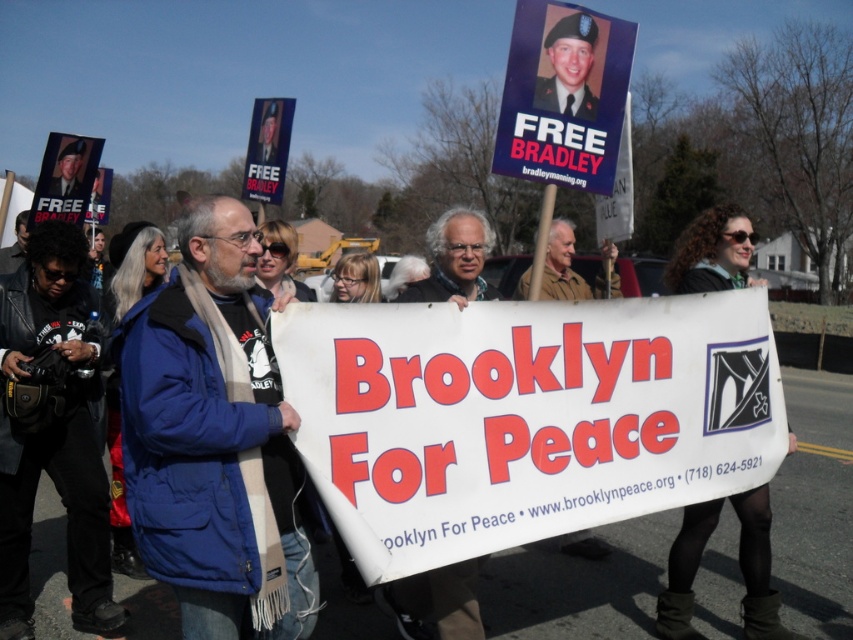
Which is more to the left, blue fabric jacket at center or black leather jacket at lower left?

From the viewer's perspective, black leather jacket at lower left appears more on the left side.

At what (x,y) coordinates should I click in order to perform the action: click on blue fabric jacket at center. Please return your answer as a coordinate pair (x, y). This screenshot has height=640, width=853. Looking at the image, I should click on (215, 440).